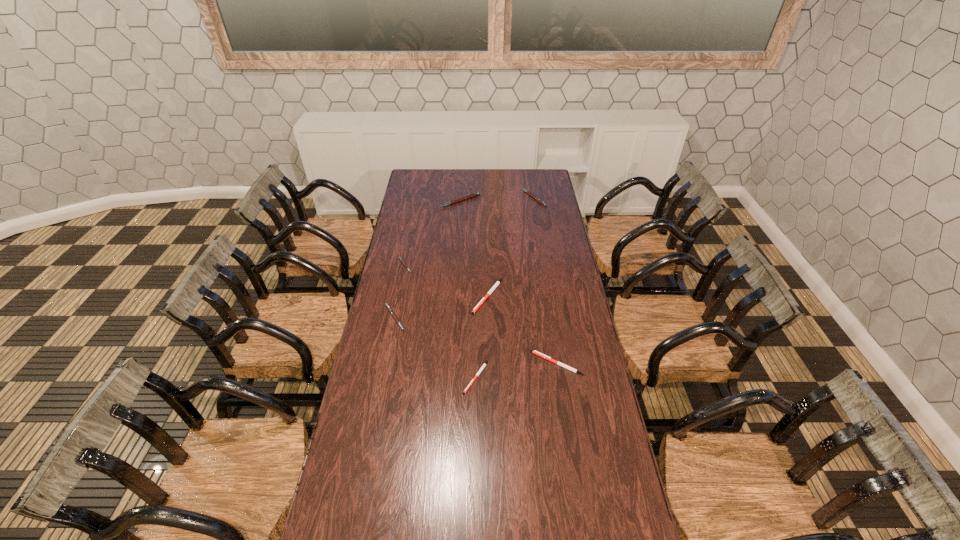
This screenshot has width=960, height=540. In order to click on vacant space that satisfies the following two spatial constraints: 1. on the clicker of the second smallest white pen; 2. on the clicker of the smallest white pen in this screenshot , I will do `click(559, 377)`.